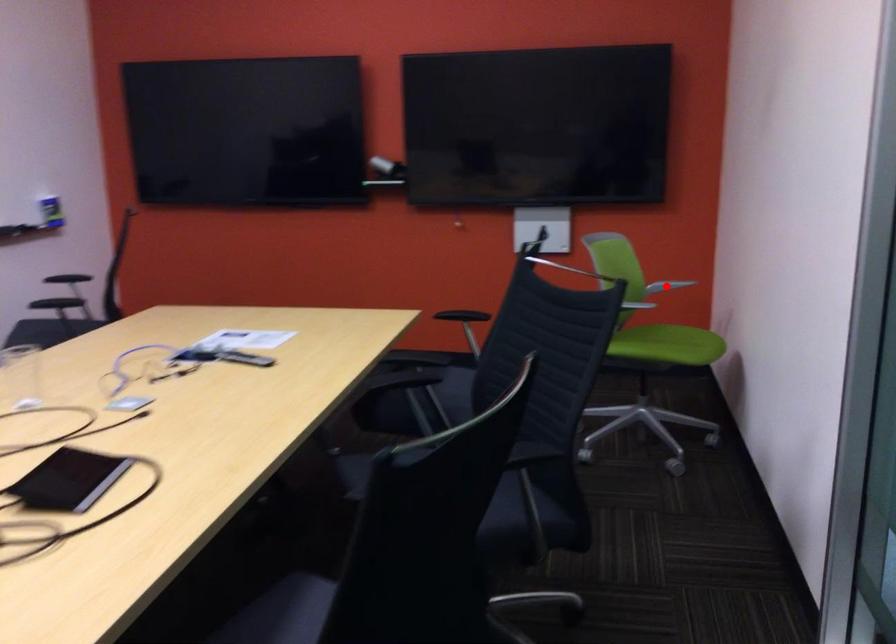
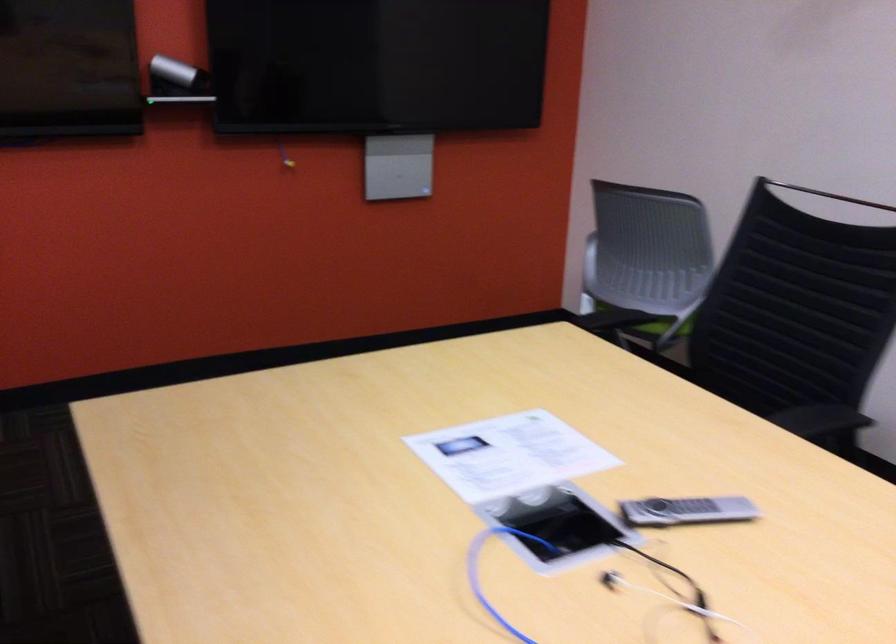
Question: I am providing you with two images of the same scene from different viewpoints. A red point is marked on the first image. At the location where the point appears in image 1, is it still visible in image 2?

Choices:
 (A) Yes
 (B) No

Answer: (B)